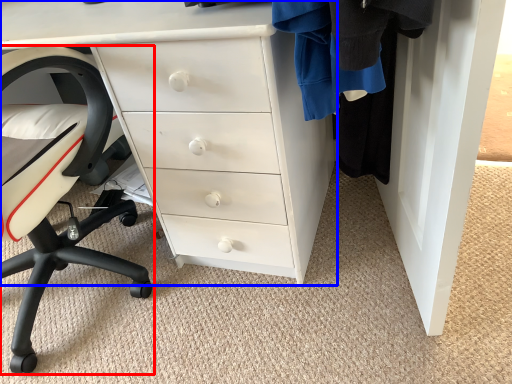
Question: Which of the following is the closest to the observer, chair (highlighted by a red box) or chest of drawers (highlighted by a blue box)?

Choices:
 (A) chair
 (B) chest of drawers

Answer: (A)